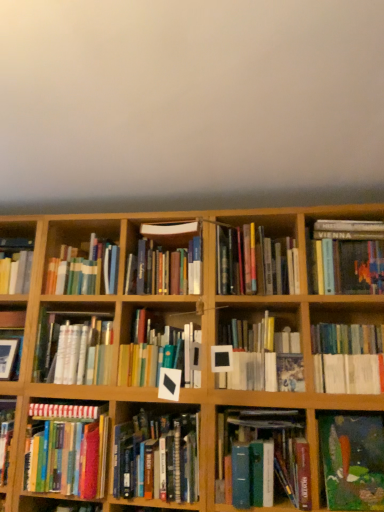
The image size is (384, 512). In order to click on hardcover books at center, which is the tenth book from left to right in this screenshot , I will do `click(255, 262)`.

What do you see at coordinates (255, 262) in the screenshot? I see `hardcover books at center, which ranks as the fourth book in right-to-left order` at bounding box center [255, 262].

Describe the element at coordinates (73, 348) in the screenshot. I see `hardcover book at center-left, which is the eleventh book in right-to-left order` at that location.

This screenshot has width=384, height=512. Describe the element at coordinates (157, 457) in the screenshot. I see `hardcover book at center, the fifth book in the left-to-right sequence` at that location.

In order to face hardcover books at center, the 6th book when ordered from right to left, should I rotate leftwards or rightwards?

To align with it, rotate right about 9.114°.

Find the location of a particular element. hardcover books at center, the 8th book positioned from the left is located at coordinates (262, 458).

Describe the element at coordinates (353, 461) in the screenshot. I see `oil painting at lower right, which is the third book in right-to-left order` at that location.

You are a GUI agent. You are given a task and a screenshot of the screen. Output one action in this format:
    pyautogui.click(x=<x>, y=<y>)
    Task: Click on the hardcover books at center, which ranks as the fourth book in right-to-left order
    
    Given the screenshot: What is the action you would take?
    pyautogui.click(x=255, y=262)

Is hardcover books at left, marked as the twelfth book in a right-to-left arrangement, aimed at hardcover books at center, the 8th book positioned from the left?

No, hardcover books at left, marked as the twelfth book in a right-to-left arrangement, is not oriented towards hardcover books at center, the 8th book positioned from the left.

Looking at the image, does hardcover books at left, arranged as the second book when viewed from the left, seem bigger or smaller compared to hardcover books at center, the 6th book when ordered from right to left?

In the image, hardcover books at left, arranged as the second book when viewed from the left, appears to be larger than hardcover books at center, the 6th book when ordered from right to left.

Which is correct: hardcover books at left, marked as the twelfth book in a right-to-left arrangement, is inside hardcover books at center, the 6th book when ordered from right to left, or outside of it?

The correct answer is: outside.

Is hardcover book at upper right, the first book in the right-to-left sequence, turned away from hardcover books at center, the 7th book from the left?

hardcover book at upper right, the first book in the right-to-left sequence, is not turned away from hardcover books at center, the 7th book from the left.

Which object is positioned more to the right, hardcover book at upper right, the 13th book from the left, or hardcover books at center, placed as the 7th book when sorted from right to left?

hardcover book at upper right, the 13th book from the left, is more to the right.

Which object is further away from the camera taking this photo, hardcover book at upper right, the first book in the right-to-left sequence, or hardcover books at center, placed as the 7th book when sorted from right to left?

hardcover books at center, placed as the 7th book when sorted from right to left, is more distant.

From a real-world perspective, is hardcover book at upper right, the 13th book from the left, on hardcover books at center, the 7th book from the left?

No, from a real-world perspective, hardcover book at upper right, the 13th book from the left, is not on top of hardcover books at center, the 7th book from the left.

Is hardcover book at center-left, the third book from the left, with hardcover books at center, the 7th book from the left?

No, hardcover book at center-left, the third book from the left, is not in contact with hardcover books at center, the 7th book from the left.

Is hardcover book at center-left, the third book from the left, not inside hardcover books at center, the 7th book from the left?

hardcover book at center-left, the third book from the left, is positioned outside hardcover books at center, the 7th book from the left.

Can you tell me how much hardcover book at center-left, the third book from the left, and hardcover books at center, the 7th book from the left, differ in facing direction?

0.000531 degrees separate the facing orientations of hardcover book at center-left, the third book from the left, and hardcover books at center, the 7th book from the left.

Is hardcover book at center-left, the third book from the left, wider than hardcover books at center, placed as the 7th book when sorted from right to left?

No.

Is hardcover books at left, arranged as the second book when viewed from the left, smaller than hardcover book at upper right, the first book in the right-to-left sequence?

Incorrect, hardcover books at left, arranged as the second book when viewed from the left, is not smaller in size than hardcover book at upper right, the first book in the right-to-left sequence.

From a real-world perspective, which is physically above, hardcover books at left, arranged as the second book when viewed from the left, or hardcover book at upper right, the 13th book from the left?

hardcover book at upper right, the 13th book from the left.

From the picture: Is hardcover book at upper right, the first book in the right-to-left sequence, at the back of hardcover books at left, arranged as the second book when viewed from the left?

hardcover books at left, arranged as the second book when viewed from the left, does not have its back to hardcover book at upper right, the first book in the right-to-left sequence.

How many degrees apart are the facing directions of hardcover books at left, arranged as the second book when viewed from the left, and hardcover book at upper right, the 13th book from the left?

The facing directions of hardcover books at left, arranged as the second book when viewed from the left, and hardcover book at upper right, the 13th book from the left, are 0.0937 degrees apart.

Is point (222, 474) closer or farther from the camera than point (322, 323)?

Point (222, 474) is positioned closer to the camera compared to point (322, 323).

Does hardcover books at center, the 8th book positioned from the left, touch hardcover books at center right, acting as the 2th book starting from the right?

hardcover books at center, the 8th book positioned from the left, and hardcover books at center right, acting as the 2th book starting from the right, are not in contact.

Locate an element on the screen. This screenshot has width=384, height=512. book that is the 7th object located below the hardcover books at center right, the 12th book positioned from the left (from the image's perspective) is located at coordinates (262, 458).

Would you say hardcover books at center, the 8th book positioned from the left, is outside hardcover books at center right, acting as the 2th book starting from the right?

Yes, hardcover books at center, the 8th book positioned from the left, is outside of hardcover books at center right, acting as the 2th book starting from the right.

Is hardcover books at center, the 6th book when ordered from right to left, taller or shorter than hardcover book at upper right, the first book in the right-to-left sequence?

Considering their sizes, hardcover books at center, the 6th book when ordered from right to left, has more height than hardcover book at upper right, the first book in the right-to-left sequence.

Based on the photo, considering the positions of objects hardcover books at center, the 8th book positioned from the left, and hardcover book at upper right, the 13th book from the left, in the image provided, who is in front, hardcover books at center, the 8th book positioned from the left, or hardcover book at upper right, the 13th book from the left,?

hardcover books at center, the 8th book positioned from the left, is closer to the camera.

Does point (290, 430) come farther from viewer compared to point (372, 254)?

No, (290, 430) is in front of (372, 254).

Could you tell me if hardcover books at center, the 6th book when ordered from right to left, is facing hardcover book at upper right, the first book in the right-to-left sequence?

No, hardcover books at center, the 6th book when ordered from right to left, is not aimed at hardcover book at upper right, the first book in the right-to-left sequence.

From a real-world perspective, does hardcover books at center, the 7th book from the left, sit lower than hardcover books at left, arranged as the second book when viewed from the left?

No, from a real-world perspective, hardcover books at center, the 7th book from the left, is not below hardcover books at left, arranged as the second book when viewed from the left.

Is hardcover books at center, placed as the 7th book when sorted from right to left, aimed at hardcover books at left, arranged as the second book when viewed from the left?

No.

Is hardcover books at center, placed as the 7th book when sorted from right to left, shorter than hardcover books at left, arranged as the second book when viewed from the left?

Correct, hardcover books at center, placed as the 7th book when sorted from right to left, is not as tall as hardcover books at left, arranged as the second book when viewed from the left.

Which object is closer to the camera taking this photo, hardcover books at center, placed as the 7th book when sorted from right to left, or hardcover books at left, arranged as the second book when viewed from the left?

hardcover books at left, arranged as the second book when viewed from the left, is more forward.

This screenshot has height=512, width=384. What are the coordinates of `book that is the 2nd one below the hardcover books at center, the 6th book when ordered from right to left (from a real-world perspective)` in the screenshot? It's located at (67, 450).

From the hardcover books at center, placed as the 7th book when sorted from right to left, count 2nd books forward and point to it. Please provide its 2D coordinates.

[(347, 257)]

Looking at this image, looking at the image, which one is located closer to oil painting at lower right, which is the third book in right-to-left order, hardcover books at center, marked as the sixth book in a left-to-right arrangement, or hardcover book at upper right, the 13th book from the left?

hardcover book at upper right, the 13th book from the left, lies closer to oil painting at lower right, which is the third book in right-to-left order, than the other object.

Considering their positions, is hardcover book at left, which is the 13th book from right to left, positioned further to hardcover book at center, the fifth book in the left-to-right sequence, than hardcover books at center, which ranks as the fourth book in right-to-left order?

hardcover book at left, which is the 13th book from right to left, is further to hardcover book at center, the fifth book in the left-to-right sequence.

When comparing their distances from hardcover books at center, the 7th book from the left, does hardcover books at center right, acting as the 2th book starting from the right, or white matte book at center, the ninth book viewed from the left, seem closer?

white matte book at center, the ninth book viewed from the left, lies closer to hardcover books at center, the 7th book from the left, than the other object.

Based on their spatial positions, is hardcover books at center, the 7th book from the left, or white matte book at center, arranged as the fifth book when viewed from the right, closer to hardcover books at center right, the 12th book positioned from the left?

white matte book at center, arranged as the fifth book when viewed from the right, is closer to hardcover books at center right, the 12th book positioned from the left.

From the image, which object appears to be farther from hardcover book at upper right, the first book in the right-to-left sequence, white matte book at center, arranged as the fifth book when viewed from the right, or hardcover book at center-left, which is the eleventh book in right-to-left order?

Among the two, hardcover book at center-left, which is the eleventh book in right-to-left order, is located further to hardcover book at upper right, the first book in the right-to-left sequence.

Estimate the real-world distances between objects in this image. Which object is closer to oil painting at lower right, which is the third book in right-to-left order, hardcover books at left, marked as the twelfth book in a right-to-left arrangement, or hardcover books at center, the eighth book viewed from the right?

hardcover books at center, the eighth book viewed from the right, is positioned closer to the anchor oil painting at lower right, which is the third book in right-to-left order.

Based on their spatial positions, is hardcover books at center right, acting as the 2th book starting from the right, or hardcover books at center, marked as the sixth book in a left-to-right arrangement, further from oil painting at lower right, the 11th book in the left-to-right sequence?

hardcover books at center, marked as the sixth book in a left-to-right arrangement, is further to oil painting at lower right, the 11th book in the left-to-right sequence.

From the image, which object appears to be nearer to oil painting at lower right, which is the third book in right-to-left order, hardcover book at left, which is the 13th book from right to left, or hardcover books at center, the 8th book positioned from the left?

hardcover books at center, the 8th book positioned from the left, is closer to oil painting at lower right, which is the third book in right-to-left order.

This screenshot has height=512, width=384. What are the coordinates of `book between hardcover book at left, which is the 13th book from right to left, and hardcover book at center-left, the third book from the left, from left to right` in the screenshot? It's located at (67, 450).